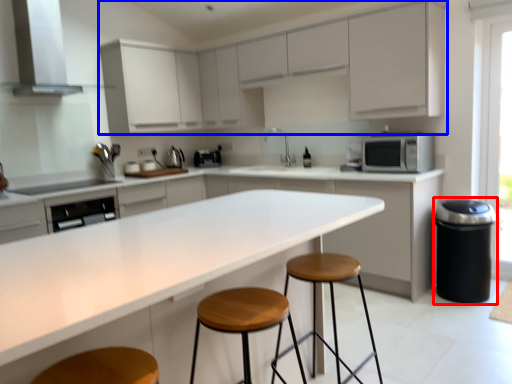
Question: Among these objects, which one is nearest to the camera, appliance (highlighted by a red box) or cabinetry (highlighted by a blue box)?

Choices:
 (A) appliance
 (B) cabinetry

Answer: (B)